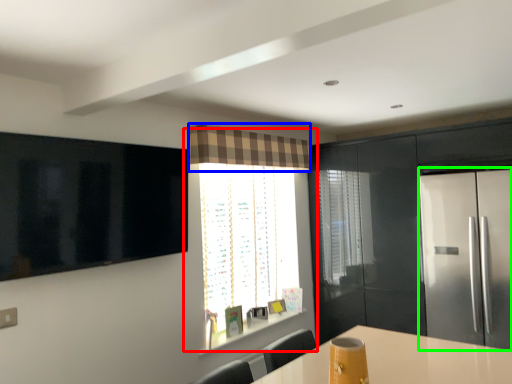
Question: Which object is positioned farthest from window (highlighted by a red box)? Select from curtain (highlighted by a blue box) and fridge (highlighted by a green box).

Choices:
 (A) curtain
 (B) fridge

Answer: (B)